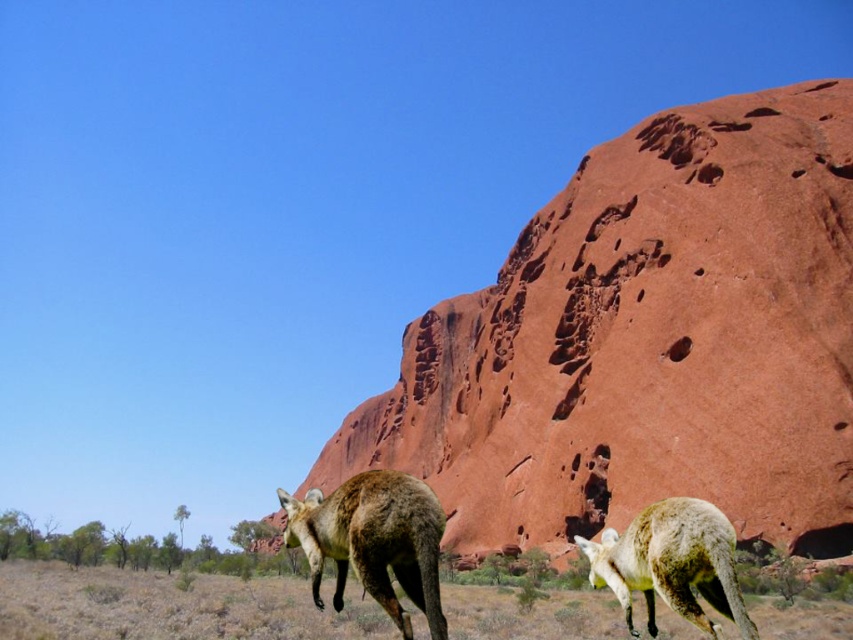
You are a photographer standing in the desert and want to take a photo of the rustic sandstone rock at center and the brown fur kangaroo at center. Which object should you adjust your camera to focus on first if you want to capture both in the same frame?

The rustic sandstone rock at center is positioned on the right side of the brown fur kangaroo at center, so you should focus on the brown fur kangaroo at center first to ensure both are in the same frame.

You are a photographer wanting to capture the rustic sandstone rock at center and the white fur kangaroo at lower right in the same frame. Based on their sizes, which one will appear larger in the photo?

The rustic sandstone rock at center will appear much larger in the photo than the white fur kangaroo at lower right because it is much taller as the kangaroo.